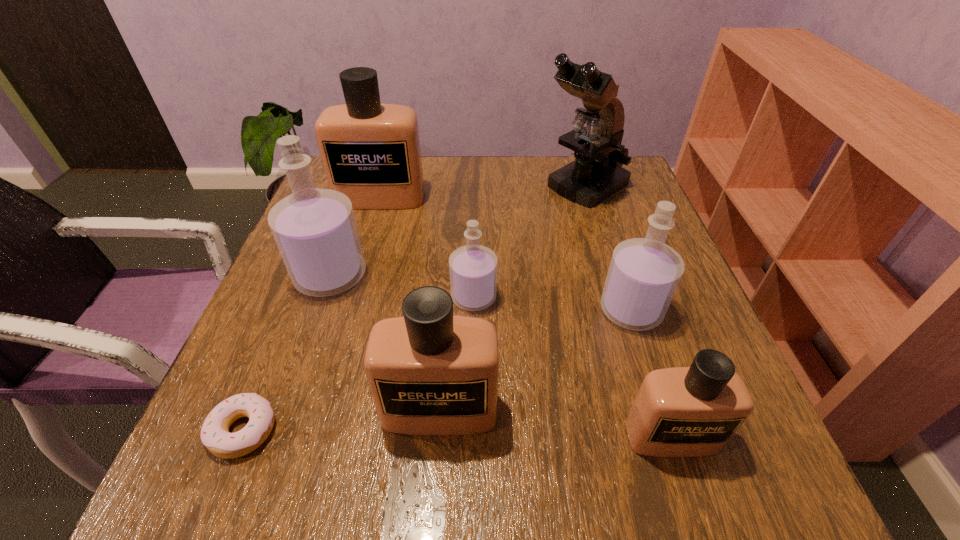
This screenshot has width=960, height=540. In order to click on vacant area located on the left of the microscope in this screenshot , I will do `click(511, 187)`.

The height and width of the screenshot is (540, 960). Identify the location of vacant space located 0.350m on the front label of the farthest perfume. (345, 322).

You are a GUI agent. You are given a task and a screenshot of the screen. Output one action in this format:
    pyautogui.click(x=<x>, y=<y>)
    Task: Click on the vacant area situated on the front of the biggest purple perfume
    
    Given the screenshot: What is the action you would take?
    pyautogui.click(x=262, y=470)

Find the location of a particular element. Image resolution: width=960 pixels, height=540 pixels. free space located 0.130m on the back of the rightmost purple perfume is located at coordinates (610, 246).

Find the location of a particular element. The width and height of the screenshot is (960, 540). free space located on the front label of the second biggest beige perfume is located at coordinates (434, 493).

The height and width of the screenshot is (540, 960). Find the location of `vacant space situated 0.060m on the right of the second purple perfume from right to left`. vacant space situated 0.060m on the right of the second purple perfume from right to left is located at coordinates (527, 297).

Where is `vacant region located on the front label of the rightmost beige perfume`? vacant region located on the front label of the rightmost beige perfume is located at coordinates (693, 503).

Image resolution: width=960 pixels, height=540 pixels. What are the coordinates of `free space located 0.310m on the right of the doughnut` in the screenshot? It's located at (485, 430).

Locate an element on the screen. This screenshot has width=960, height=540. microscope present at the far edge is located at coordinates (597, 173).

Locate an element on the screen. perfume situated at the far edge is located at coordinates (370, 151).